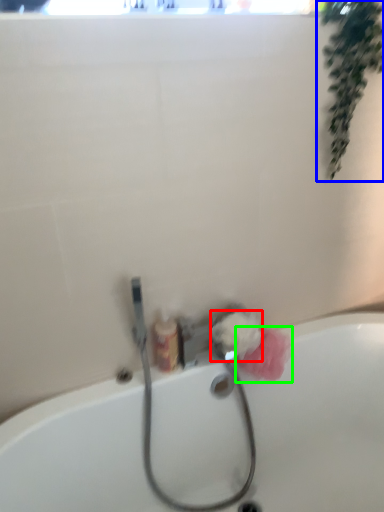
Question: Considering the real-world distances, which object is closest to flower (highlighted by a red box)? plant (highlighted by a blue box) or flower (highlighted by a green box).

Choices:
 (A) plant
 (B) flower

Answer: (B)